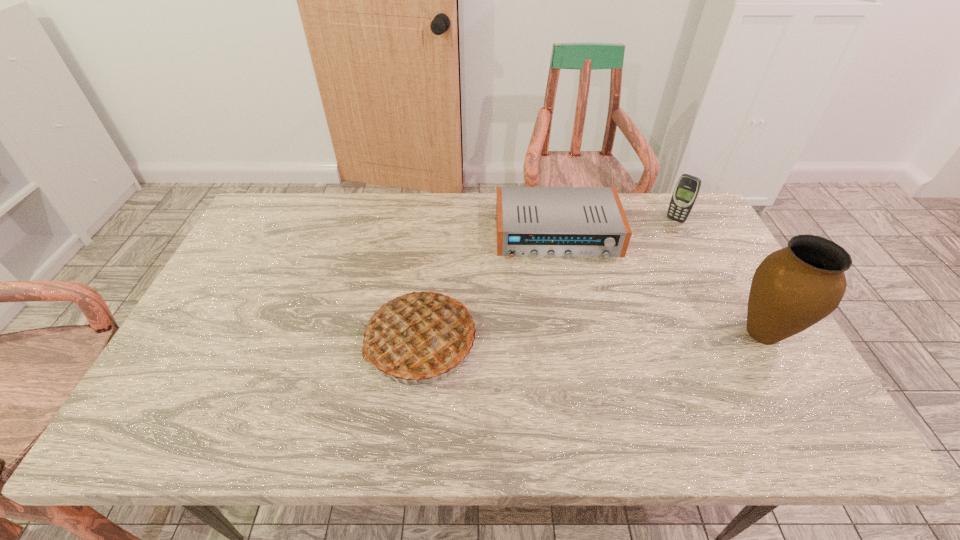
The height and width of the screenshot is (540, 960). Find the location of `free space on the desktop that is between the pie and the tallest object and is positioned on the screen of the third tallest object`. free space on the desktop that is between the pie and the tallest object and is positioned on the screen of the third tallest object is located at coordinates (577, 338).

Find the location of a particular element. Image resolution: width=960 pixels, height=540 pixels. vacant spot on the desktop that is between the pie and the urn and is positioned on the front panel of the radio receiver is located at coordinates pos(575,338).